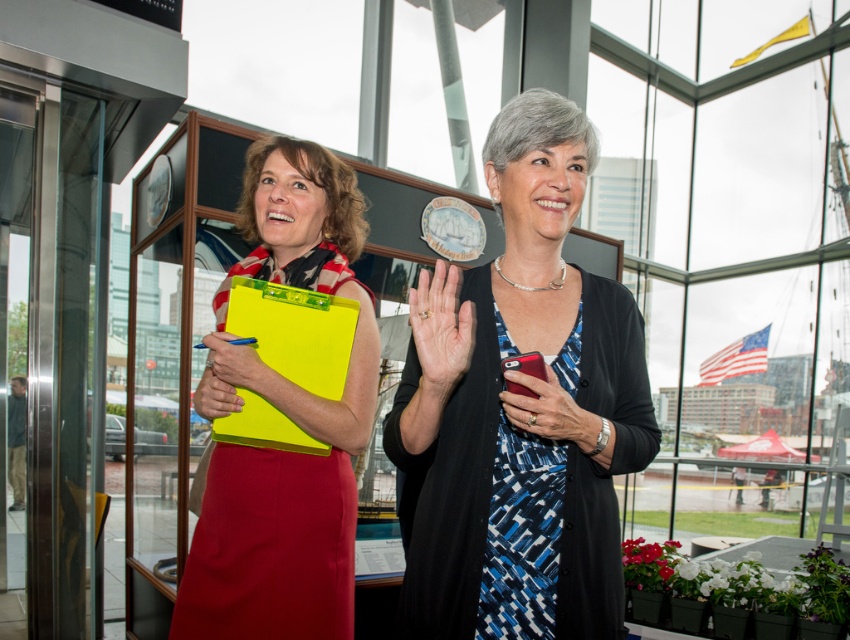
I want to click on blue printed dress at center, so (x=519, y=410).

Which of these two, blue printed dress at center or matte yellow clipboard at center, stands taller?

With more height is matte yellow clipboard at center.

Is point (400, 385) farther from viewer compared to point (306, 497)?

No.

You are a GUI agent. You are given a task and a screenshot of the screen. Output one action in this format:
    pyautogui.click(x=<x>, y=<y>)
    Task: Click on the blue printed dress at center
    This screenshot has height=640, width=850.
    Given the screenshot: What is the action you would take?
    pyautogui.click(x=519, y=410)